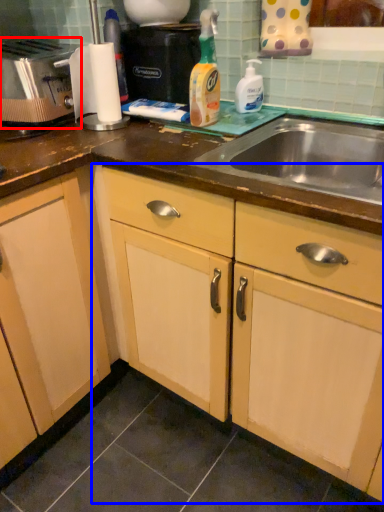
Question: Which object appears farthest to the camera in this image, toaster (highlighted by a red box) or cabinetry (highlighted by a blue box)?

Choices:
 (A) toaster
 (B) cabinetry

Answer: (A)